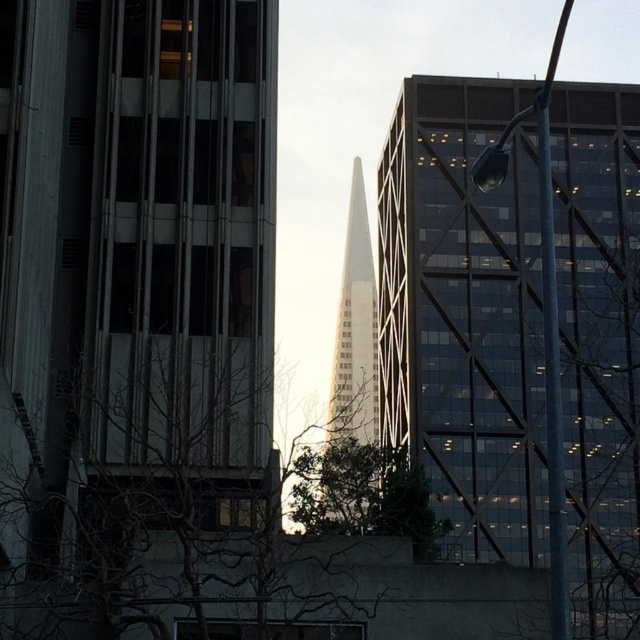
Question: From the image, what is the correct spatial relationship of glassy reflective skyscraper at center in relation to glassy white skyscraper at center?

Choices:
 (A) above
 (B) below

Answer: (B)

Question: Is glassy reflective skyscraper at center in front of glassy white skyscraper at center?

Choices:
 (A) yes
 (B) no

Answer: (A)

Question: Is glassy reflective skyscraper at center further to camera compared to glassy white skyscraper at center?

Choices:
 (A) yes
 (B) no

Answer: (B)

Question: Among these points, which one is farthest from the camera?

Choices:
 (A) (340, 364)
 (B) (632, 392)

Answer: (A)